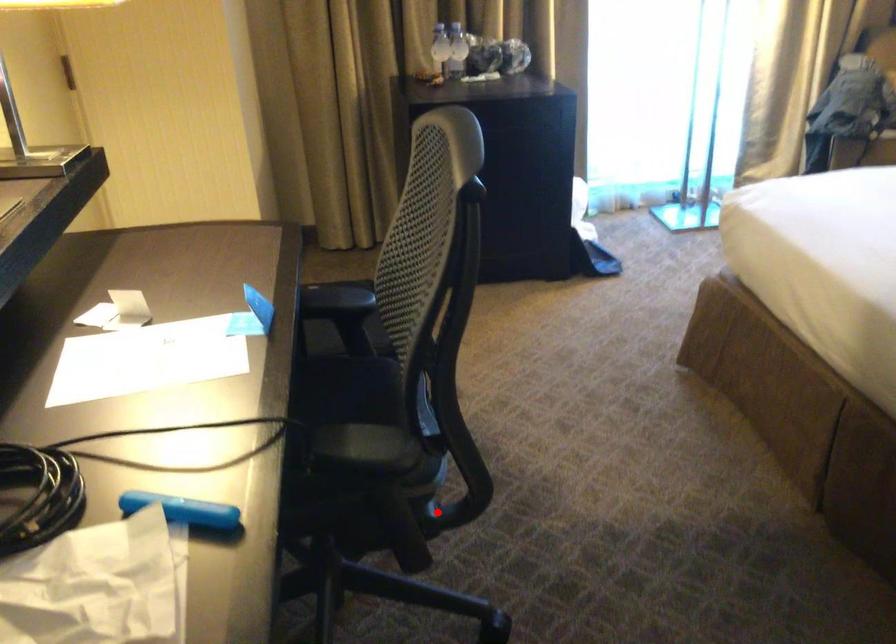
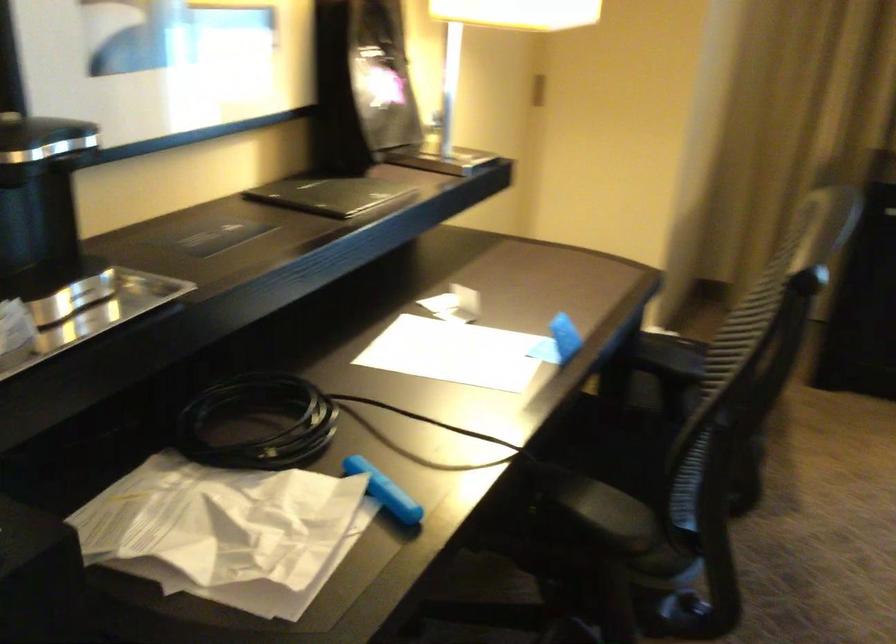
Question: I am providing you with two images of the same scene from different viewpoints. A red point is shown in image1. For the corresponding object point in image2, is it positioned nearer or farther from the camera?

Choices:
 (A) Nearer
 (B) Farther

Answer: (A)